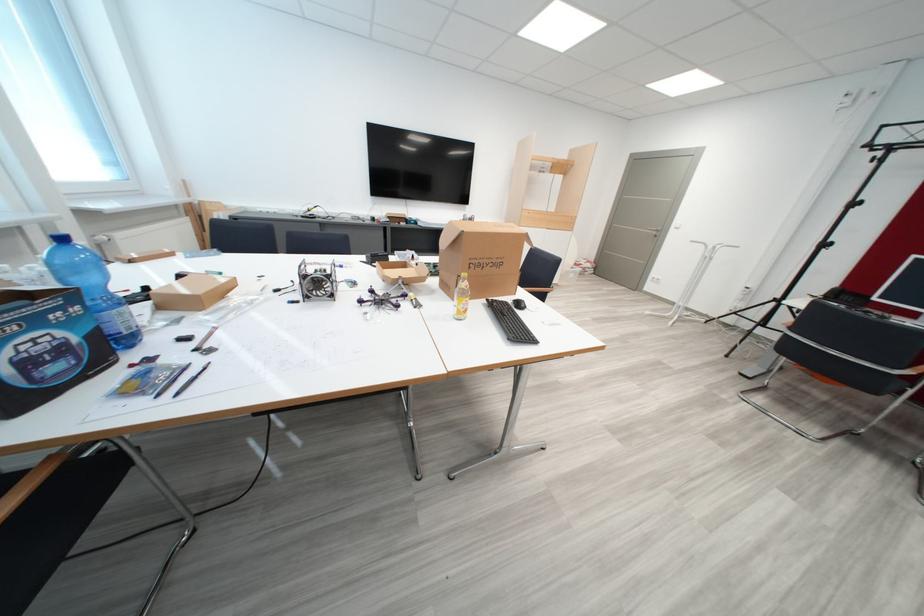
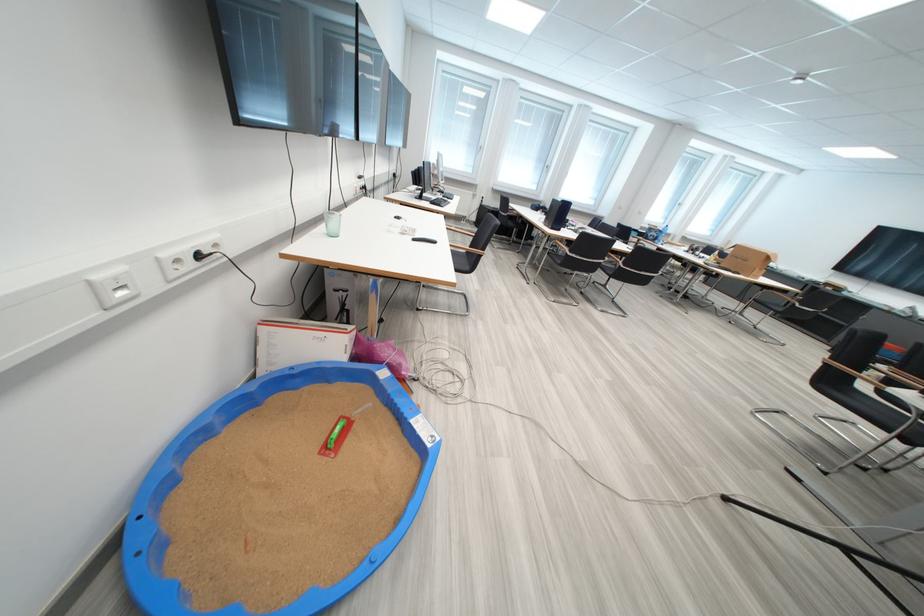
Question: I am providing you with two images of the same scene from different viewpoints. Please identify which objects are invisible in image2.

Choices:
 (A) cardboard box
 (B) toy bead maze
 (C) black chair sitting surface
 (D) white cardboard box

Answer: (C)